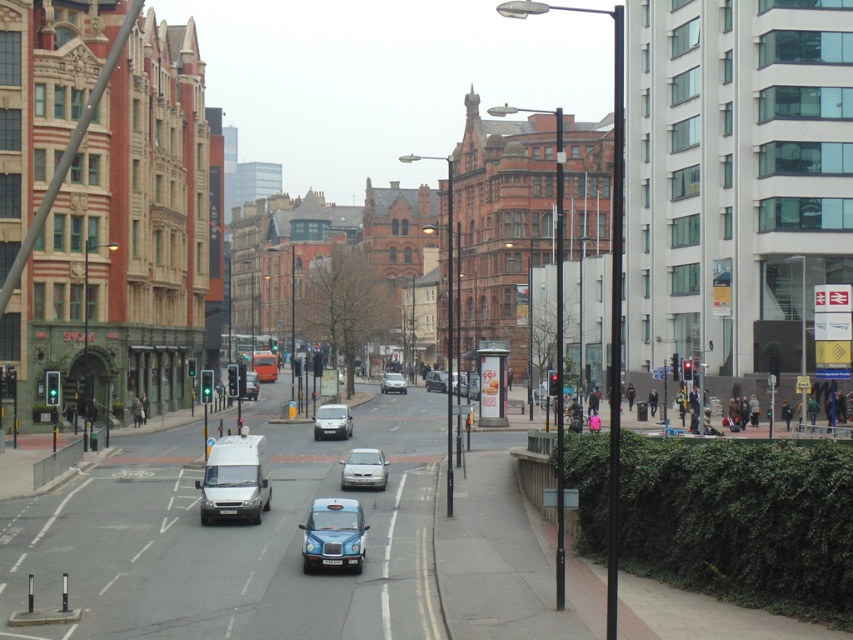
Question: Which object appears closest to the camera in this image?

Choices:
 (A) metallic silver van at center
 (B) silver metallic sedan at center
 (C) white matte van at center

Answer: (C)

Question: Which point is closer to the camera?

Choices:
 (A) (332, 500)
 (B) (352, 464)
 (C) (323, 420)
 (D) (238, 476)

Answer: (A)

Question: Which object appears closest to the camera in this image?

Choices:
 (A) metallic silver car at center
 (B) matte silver car at center
 (C) silver metallic sedan at center
 (D) white matte van at center

Answer: (D)

Question: From the image, what is the correct spatial relationship of white matte van at center in relation to metallic silver car at center?

Choices:
 (A) above
 (B) below

Answer: (B)

Question: Where is satin silver sedan at center located in relation to matte silver car at center in the image?

Choices:
 (A) above
 (B) below

Answer: (B)

Question: Can you confirm if satin silver sedan at center is positioned below matte silver car at center?

Choices:
 (A) yes
 (B) no

Answer: (A)